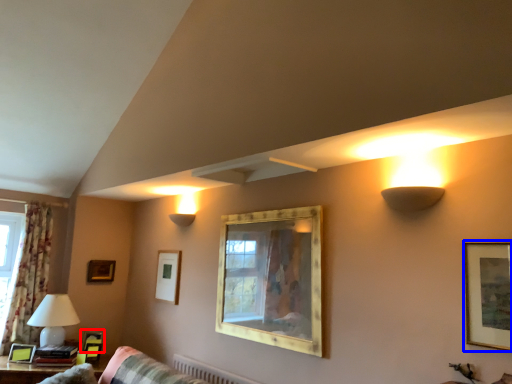
Question: Which object appears farthest to the camera in this image, picture frame (highlighted by a red box) or picture frame (highlighted by a blue box)?

Choices:
 (A) picture frame
 (B) picture frame

Answer: (A)